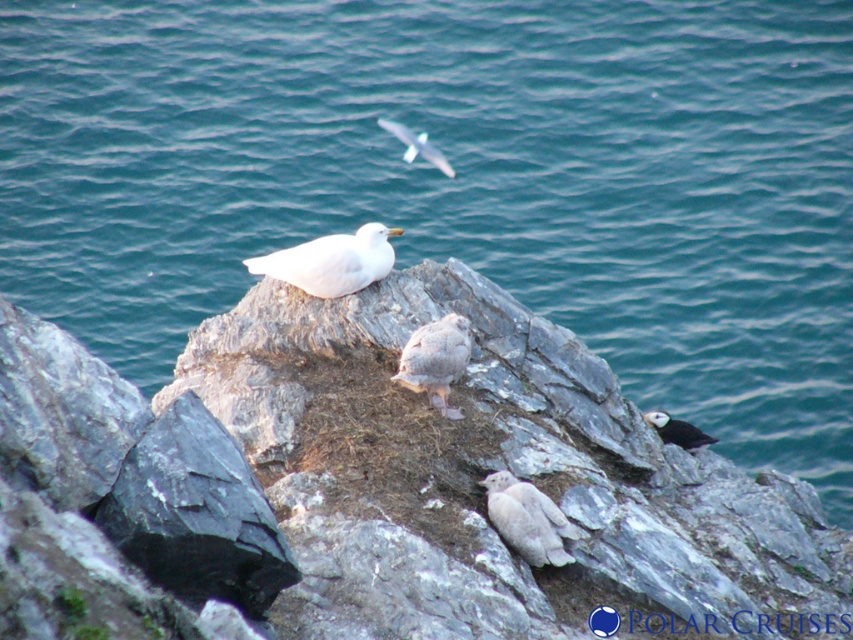
Question: Where is white fluffy bird at center located in relation to black fuzzy bird at lower right in the image?

Choices:
 (A) below
 (B) above

Answer: (B)

Question: Does white matte bird at upper center appear on the right side of black fuzzy bird at lower right?

Choices:
 (A) no
 (B) yes

Answer: (A)

Question: Does gray rock at center have a greater width compared to white fluffy bird at lower center?

Choices:
 (A) no
 (B) yes

Answer: (A)

Question: Among these points, which one is farthest from the camera?

Choices:
 (A) (804, 509)
 (B) (454, 378)

Answer: (A)

Question: Which is farther from the black fuzzy bird at lower right?

Choices:
 (A) white fluffy bird at center
 (B) white matte bird at upper center
 (C) white feathered bird at upper center
 (D) white fluffy bird at lower center

Answer: (C)

Question: Which point appears farthest from the camera in this image?

Choices:
 (A) (418, 152)
 (B) (426, 384)
 (C) (247, 269)
 (D) (468, 544)

Answer: (A)